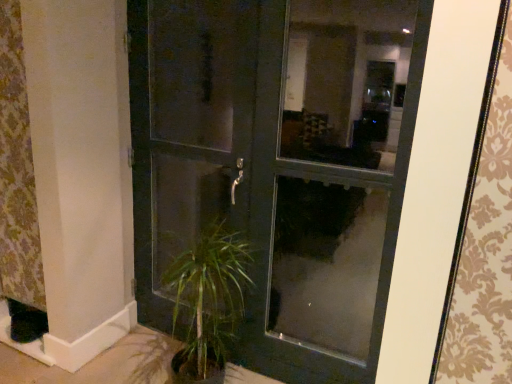
Question: Looking at the image, does matte black door at center seem bigger or smaller compared to patterned fabric curtain at left?

Choices:
 (A) big
 (B) small

Answer: (A)

Question: In terms of width, does matte black door at center look wider or thinner when compared to patterned fabric curtain at left?

Choices:
 (A) thin
 (B) wide

Answer: (B)

Question: Estimate the real-world distances between objects in this image. Which object is closer to the patterned fabric curtain at left?

Choices:
 (A) matte black door at center
 (B) matte black screen door at center

Answer: (B)

Question: Which object is the closest to the patterned fabric curtain at left?

Choices:
 (A) matte black door at center
 (B) matte black screen door at center

Answer: (B)